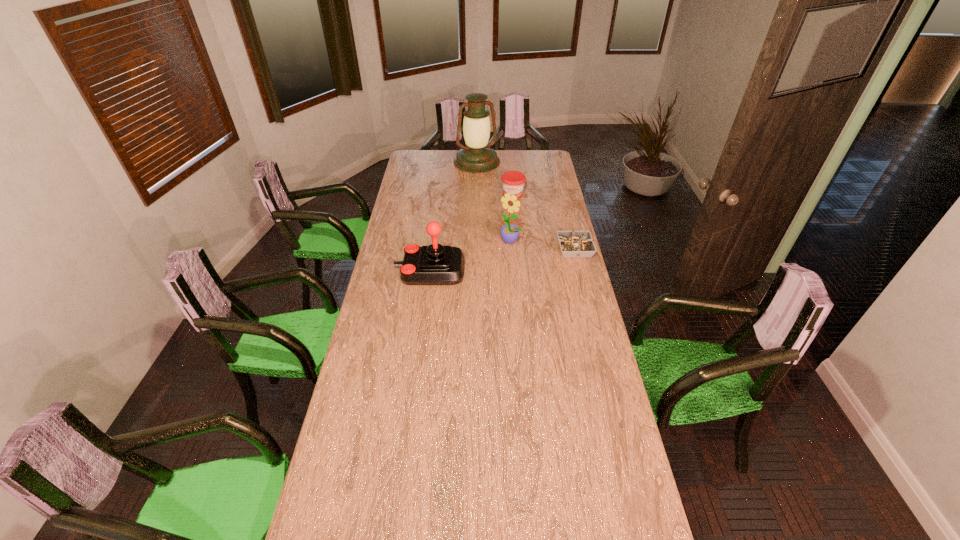
Find the location of a particular element. This screenshot has width=960, height=540. vacant space that satisfies the following two spatial constraints: 1. on the back side of the sunflower; 2. on the left side of the fourth tallest object is located at coordinates (507, 194).